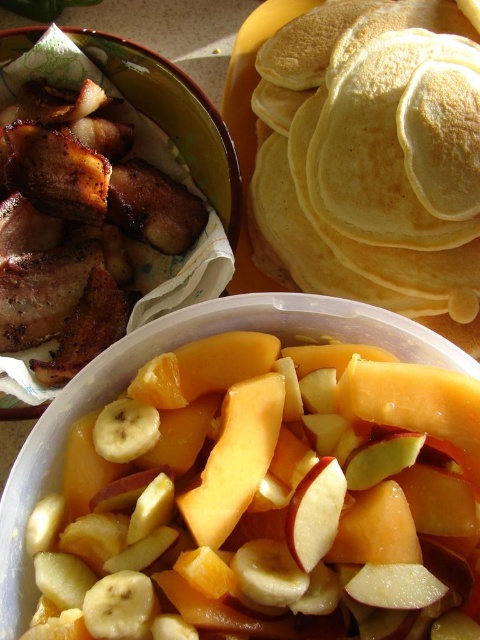
You are a chef preparing a breakfast platter and want to arrange the yellow soft pancakes at upper right and the red matte apple at center in a way that they are exactly 20 inches apart. Based on the current arrangement in the image, do you need to move them closer or farther apart?

The current distance between the yellow soft pancakes at upper right and the red matte apple at center is 20.66 inches. To achieve the desired 20 inches, you need to move them closer by 0.66 inches.

What is the 2D coordinate of the yellow soft pancakes at upper right?

The yellow soft pancakes at upper right are located at the 2D coordinate point of (374, 157).

You are a chef preparing a breakfast plate and see the yellow soft pancakes at upper right and the yellow matte banana at center. Which item is positioned higher in the image?

The yellow soft pancakes at upper right are positioned higher than the yellow matte banana at center in the image.